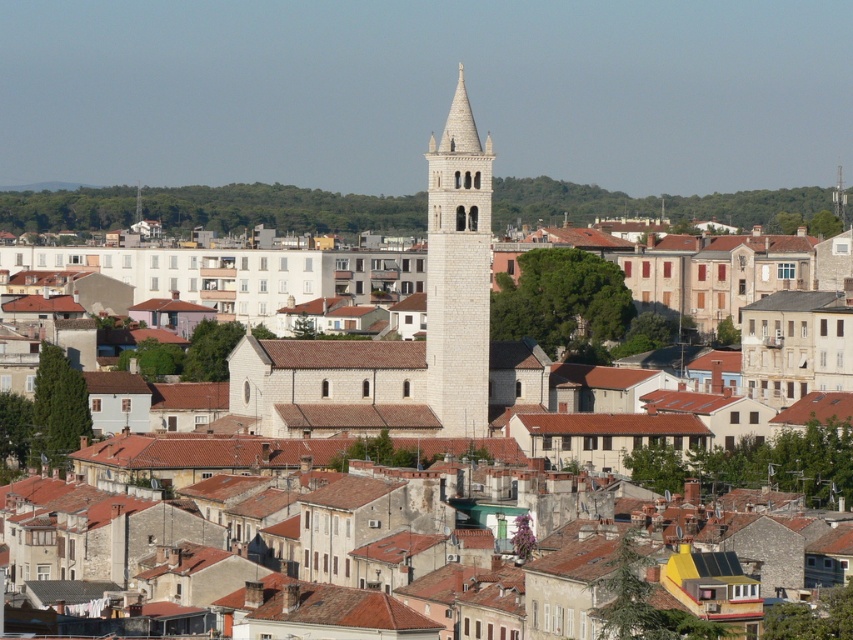
Is green leafy hillside at upper center to the left of smooth white spire at upper center from the viewer's perspective?

Incorrect, green leafy hillside at upper center is not on the left side of smooth white spire at upper center.

Can you confirm if green leafy hillside at upper center is shorter than smooth white spire at upper center?

No, green leafy hillside at upper center is not shorter than smooth white spire at upper center.

Who is more distant from viewer, (64, 225) or (140, 193)?

Point (64, 225)

Find the location of `green leafy hillside at upper center`. green leafy hillside at upper center is located at coordinates (656, 204).

Who is lower down, white stone church at center or smooth white spire at upper center?

white stone church at center is lower down.

Between white stone church at center and smooth white spire at upper center, which one appears on the left side from the viewer's perspective?

Positioned to the left is smooth white spire at upper center.

Who is more forward, (660, 442) or (136, 216)?

Positioned in front is point (660, 442).

The image size is (853, 640). I want to click on white stone church at center, so click(326, 390).

Identify the location of white stone church at center. (326, 390).

I want to click on white stone church at center, so click(326, 390).